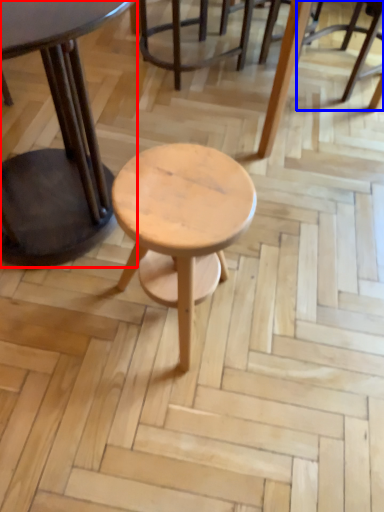
Question: Among these objects, which one is farthest to the camera, table (highlighted by a red box) or chair (highlighted by a blue box)?

Choices:
 (A) table
 (B) chair

Answer: (B)